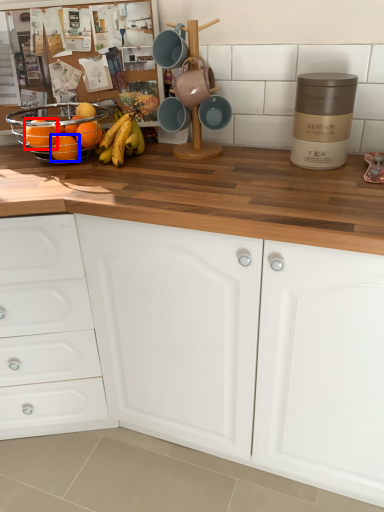
Question: Which of the following is the farthest to the observer, orange (highlighted by a red box) or orange (highlighted by a blue box)?

Choices:
 (A) orange
 (B) orange

Answer: (B)